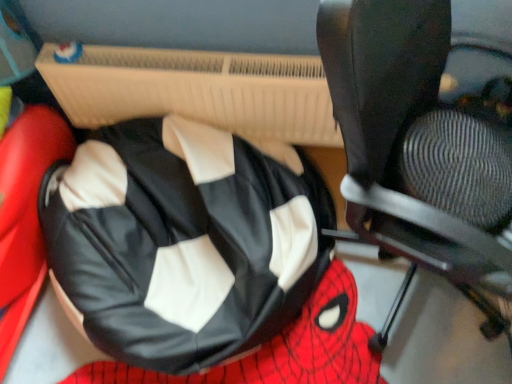
Question: Is black leather bean bag at center oriented towards black leather chair at center?

Choices:
 (A) no
 (B) yes

Answer: (A)

Question: Is black leather bean bag at center at the left side of black leather chair at center?

Choices:
 (A) no
 (B) yes

Answer: (B)

Question: Can you confirm if black leather bean bag at center is shorter than black leather chair at center?

Choices:
 (A) yes
 (B) no

Answer: (A)

Question: From the image's perspective, does black leather bean bag at center appear higher than black leather chair at center?

Choices:
 (A) no
 (B) yes

Answer: (A)

Question: Is black leather bean bag at center positioned beyond the bounds of black leather chair at center?

Choices:
 (A) yes
 (B) no

Answer: (A)

Question: Is black leather bean bag at center at the right side of black leather chair at center?

Choices:
 (A) yes
 (B) no

Answer: (B)

Question: Is black leather chair at center smaller than black leather bean bag at center?

Choices:
 (A) yes
 (B) no

Answer: (B)

Question: From a real-world perspective, is black leather chair at center located higher than black leather bean bag at center?

Choices:
 (A) no
 (B) yes

Answer: (B)

Question: Is the position of black leather chair at center less distant than that of black leather bean bag at center?

Choices:
 (A) yes
 (B) no

Answer: (A)

Question: Does black leather chair at center come behind black leather bean bag at center?

Choices:
 (A) no
 (B) yes

Answer: (A)

Question: Is black leather chair at center wider than black leather bean bag at center?

Choices:
 (A) no
 (B) yes

Answer: (A)

Question: Could you tell me if black leather chair at center is facing black leather bean bag at center?

Choices:
 (A) no
 (B) yes

Answer: (A)

Question: Is black leather bean bag at center wider or thinner than black leather chair at center?

Choices:
 (A) thin
 (B) wide

Answer: (B)